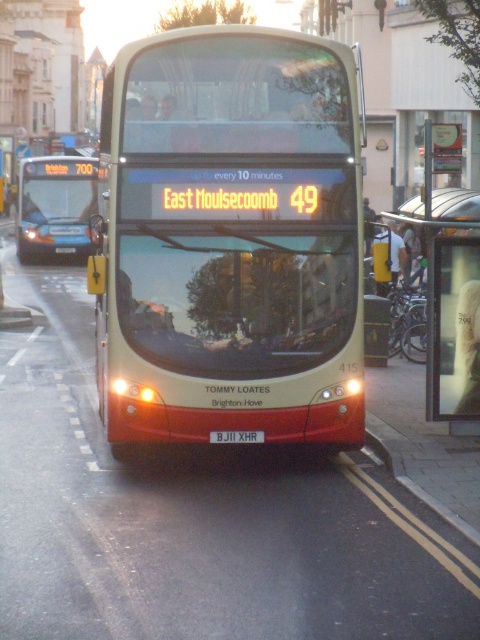
Question: Which point is farther from the camera taking this photo?

Choices:
 (A) click(463, 529)
 (B) click(219, 433)

Answer: (B)

Question: Is beige matte bus at center to the left of matte blue bus at left from the viewer's perspective?

Choices:
 (A) no
 (B) yes

Answer: (A)

Question: In this image, where is beige matte bus at center located relative to matte blue bus at left?

Choices:
 (A) below
 (B) above

Answer: (A)

Question: Which of these objects is positioned farthest from the matte blue bus at left?

Choices:
 (A) beige matte bus at center
 (B) metallic gray curb at lower right
 (C) transparent glass bus stop at center
 (D) black plastic license plate at center

Answer: (A)

Question: Is transparent glass bus stop at center smaller than metallic gray curb at lower right?

Choices:
 (A) yes
 (B) no

Answer: (B)

Question: Which point is closer to the camera taking this photo?

Choices:
 (A) (220, 442)
 (B) (81, 232)
 (C) (444, 278)

Answer: (A)